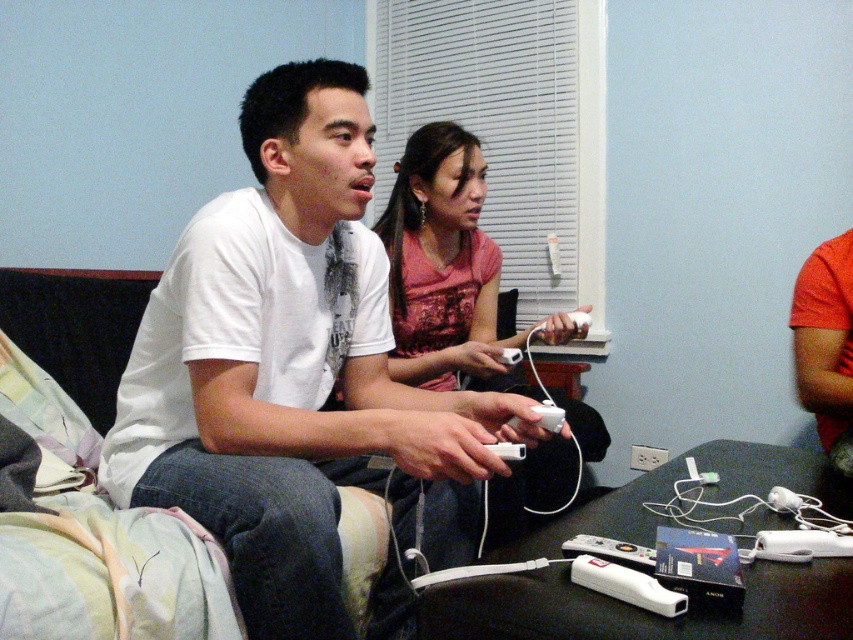
Question: Can you confirm if white matte wii remote at lower center is positioned to the right of white plastic remote at center?

Choices:
 (A) no
 (B) yes

Answer: (A)

Question: Can you confirm if matte pink shirt at center is bigger than white plastic remote at center?

Choices:
 (A) no
 (B) yes

Answer: (B)

Question: Estimate the real-world distances between objects in this image. Which object is closer to the matte pink shirt at center?

Choices:
 (A) white matte wii remote at lower center
 (B) white matte shirt at center
 (C) white plastic remote at center

Answer: (B)

Question: Which is nearer to the matte pink shirt at center?

Choices:
 (A) white plastic remote at center
 (B) white matte shirt at center

Answer: (B)

Question: Which of these objects is positioned farthest from the white plastic remote at center?

Choices:
 (A) matte pink shirt at center
 (B) white matte shirt at center

Answer: (A)

Question: Does white matte shirt at center appear under white matte wii remote at lower center?

Choices:
 (A) yes
 (B) no

Answer: (B)